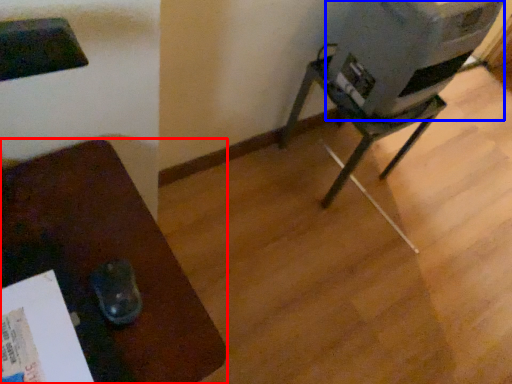
Question: Which of the following is the farthest to the observer, furniture (highlighted by a red box) or water cooler (highlighted by a blue box)?

Choices:
 (A) furniture
 (B) water cooler

Answer: (B)